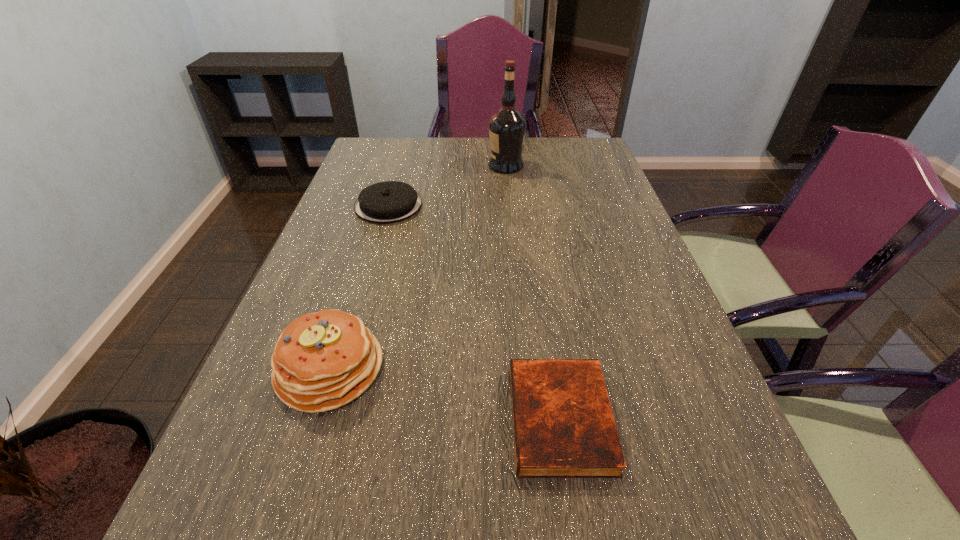
Find the location of a particular element. The height and width of the screenshot is (540, 960). free space located 0.320m on the back of the second tallest object is located at coordinates (370, 241).

Identify the location of free location located on the right of the third tallest object. (445, 206).

Locate an element on the screen. This screenshot has width=960, height=540. vacant area situated 0.270m on the spine side of the shortest object is located at coordinates (362, 419).

The height and width of the screenshot is (540, 960). What are the coordinates of `vacant space located 0.080m on the spine side of the shortest object` in the screenshot? It's located at (468, 419).

This screenshot has width=960, height=540. In order to click on vacant region located on the spine side of the shortest object in this screenshot , I will do `click(295, 419)`.

This screenshot has width=960, height=540. Find the location of `object that is at the far edge`. object that is at the far edge is located at coordinates (507, 127).

Where is `vacant space at the far edge of the desktop`? This screenshot has height=540, width=960. vacant space at the far edge of the desktop is located at coordinates (542, 160).

In the image, there is a desktop. Identify the location of vacant region at the left edge. Image resolution: width=960 pixels, height=540 pixels. (258, 384).

Identify the location of vacant space at the right edge. Image resolution: width=960 pixels, height=540 pixels. 570,193.

Locate an element on the screen. Image resolution: width=960 pixels, height=540 pixels. vacant point at the far left corner is located at coordinates (391, 138).